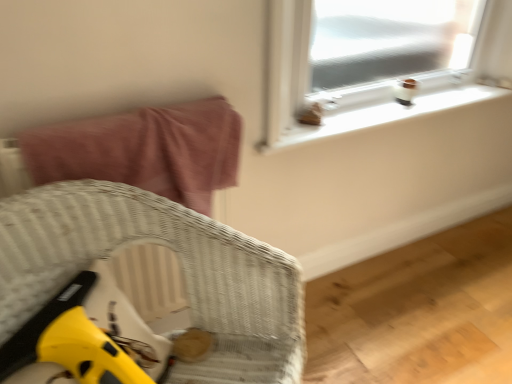
Locate an element on the screen. The width and height of the screenshot is (512, 384). free space above white plastic window sill at upper right (from a real-world perspective) is located at coordinates (399, 108).